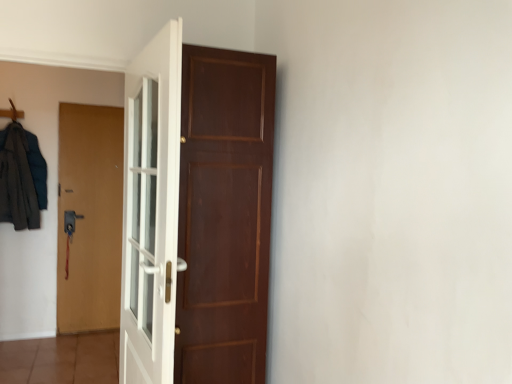
Question: Is wooden hanger at upper left at the left side of dark gray fabric coat at left?

Choices:
 (A) no
 (B) yes

Answer: (B)

Question: Can you confirm if wooden hanger at upper left is taller than dark gray fabric coat at left?

Choices:
 (A) no
 (B) yes

Answer: (A)

Question: From the image's perspective, is wooden hanger at upper left over dark gray fabric coat at left?

Choices:
 (A) yes
 (B) no

Answer: (A)

Question: Is wooden hanger at upper left outside of dark gray fabric coat at left?

Choices:
 (A) yes
 (B) no

Answer: (A)

Question: Is the surface of wooden hanger at upper left in direct contact with dark gray fabric coat at left?

Choices:
 (A) no
 (B) yes

Answer: (A)

Question: Based on their sizes in the image, would you say wooden hanger at upper left is bigger or smaller than brown matte door at left, which is the 1th door from back to front?

Choices:
 (A) small
 (B) big

Answer: (A)

Question: Considering the relative positions of wooden hanger at upper left and brown matte door at left, which is the 1th door from back to front, in the image provided, is wooden hanger at upper left to the left or to the right of brown matte door at left, which is the 1th door from back to front,?

Choices:
 (A) left
 (B) right

Answer: (A)

Question: Do you think wooden hanger at upper left is within brown matte door at left, acting as the third door starting from the right, or outside of it?

Choices:
 (A) outside
 (B) inside

Answer: (A)

Question: Considering the positions of wooden hanger at upper left and brown matte door at left, which is the third door from front to back, in the image, is wooden hanger at upper left taller or shorter than brown matte door at left, which is the third door from front to back,?

Choices:
 (A) short
 (B) tall

Answer: (A)

Question: Is brown matte door at left, which is the third door from front to back, in front of or behind brown wooden door at center, the 2th door viewed from the front, in the image?

Choices:
 (A) front
 (B) behind

Answer: (B)

Question: Is point (97, 309) positioned closer to the camera than point (188, 89)?

Choices:
 (A) farther
 (B) closer

Answer: (A)

Question: From the image's perspective, is brown matte door at left, acting as the 1th door starting from the left, above or below brown wooden door at center, arranged as the first door when viewed from the right?

Choices:
 (A) below
 (B) above

Answer: (A)

Question: Looking at the image, does brown matte door at left, which is the third door from front to back, seem bigger or smaller compared to brown wooden door at center, the 2th door viewed from the front?

Choices:
 (A) big
 (B) small

Answer: (B)

Question: Is wooden hanger at upper left wider or thinner than white glossy door at center, which ranks as the 2th door in right-to-left order?

Choices:
 (A) wide
 (B) thin

Answer: (B)

Question: In the image, is wooden hanger at upper left on the left side or the right side of white glossy door at center, arranged as the third door when viewed from the back?

Choices:
 (A) right
 (B) left

Answer: (B)